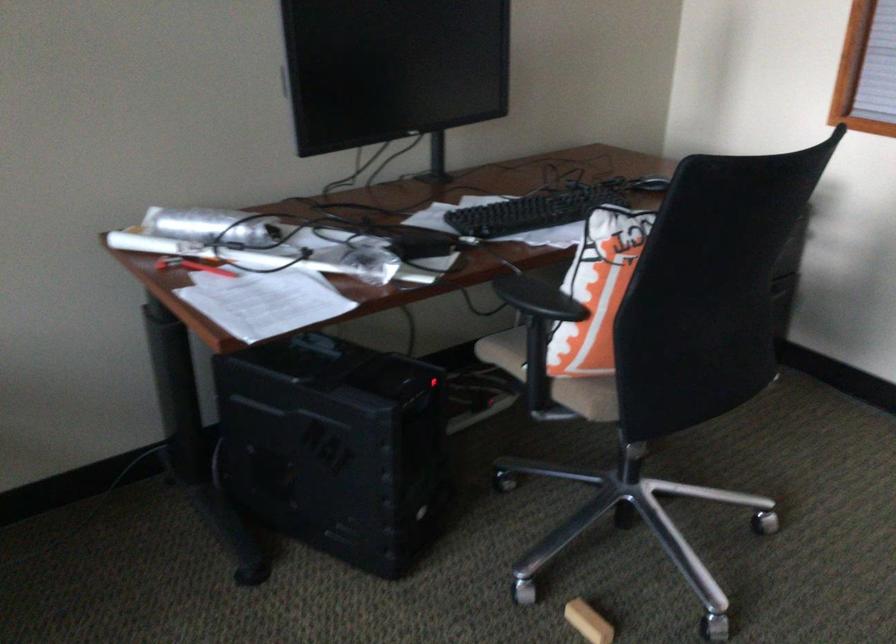
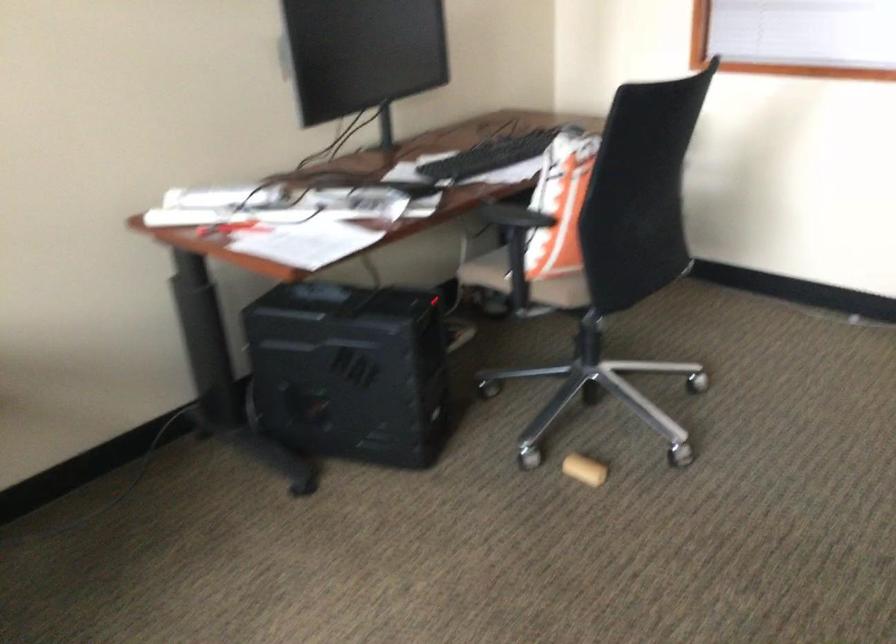
What movement of the cameraman would produce the second image?

The cameraman walked toward left, backward.